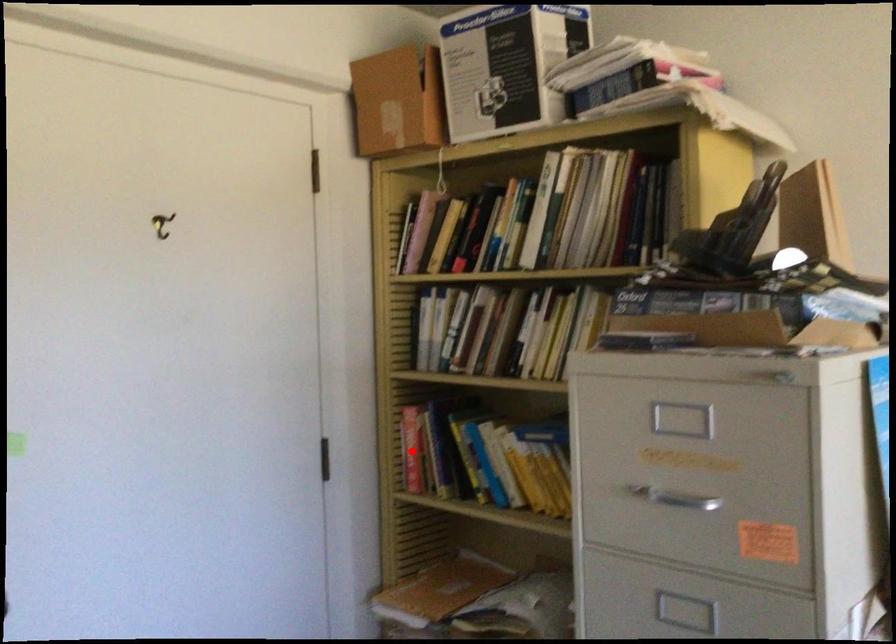
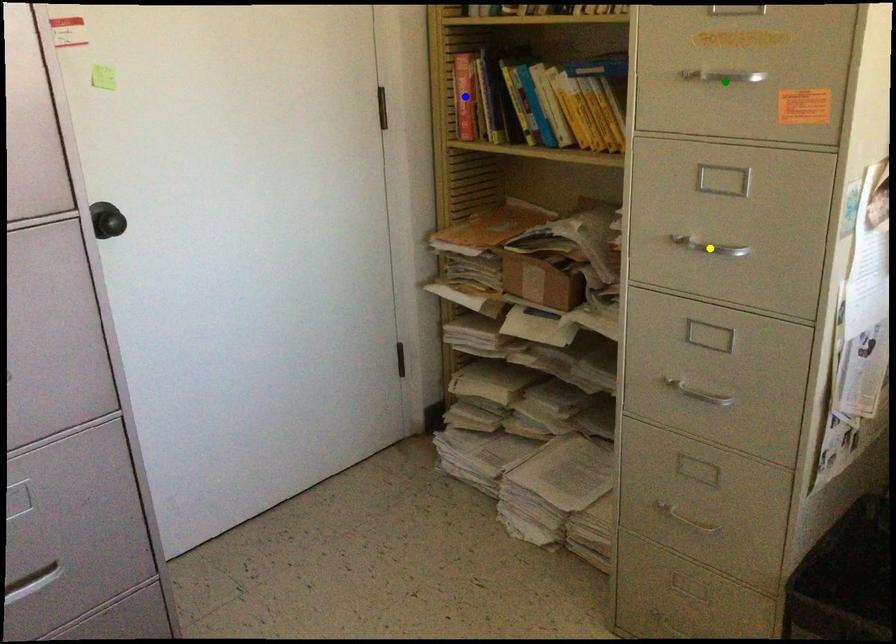
Question: I am providing you with two images of the same scene from different viewpoints. A red point is marked on the first image. You are given multiple points on the second image. Can you choose the point in image 2 that corresponds to the point in image 1?

Choices:
 (A) blue point
 (B) yellow point
 (C) green point

Answer: (A)